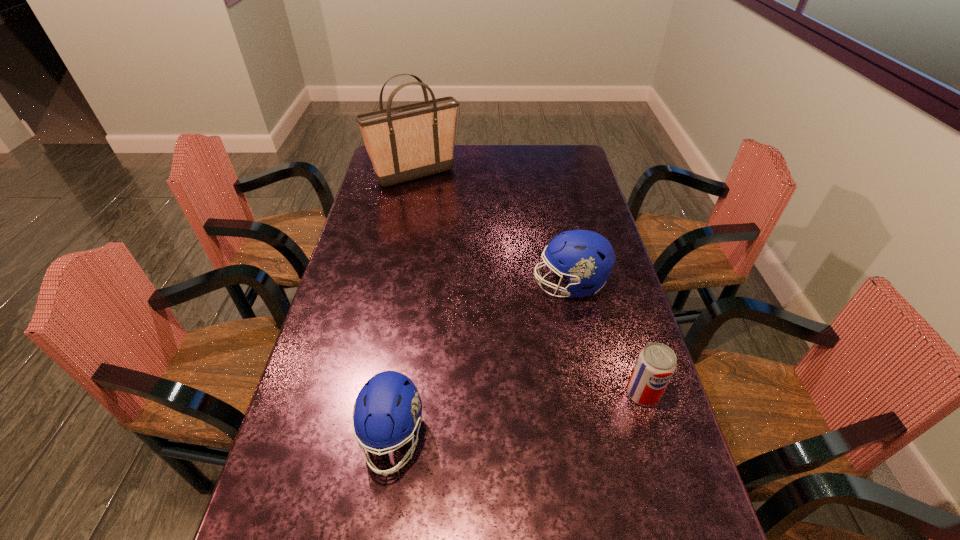
Identify the location of object that is the second closest to the farther football helmet. (388, 409).

At what (x,y) coordinates should I click in order to perform the action: click on the second closest object to the farthest object. Please return your answer as a coordinate pair (x, y). Looking at the image, I should click on (388, 409).

The image size is (960, 540). I want to click on vacant region that satisfies the following two spatial constraints: 1. on the face guard of the right football helmet; 2. on the front-facing side of the left football helmet, so (601, 438).

Where is `free space that satisfies the following two spatial constraints: 1. on the back side of the soda; 2. on the face guard of the right football helmet`? free space that satisfies the following two spatial constraints: 1. on the back side of the soda; 2. on the face guard of the right football helmet is located at coordinates (611, 285).

The image size is (960, 540). I want to click on free point that satisfies the following two spatial constraints: 1. on the face guard of the soda; 2. on the right side of the second farthest object, so click(592, 393).

At what (x,y) coordinates should I click in order to perform the action: click on free space that satisfies the following two spatial constraints: 1. on the face guard of the right football helmet; 2. on the right side of the soda. Please return your answer as a coordinate pair (x, y). Looking at the image, I should click on [592, 393].

This screenshot has height=540, width=960. I want to click on free location that satisfies the following two spatial constraints: 1. on the face guard of the second farthest object; 2. on the back side of the soda, so click(x=592, y=393).

This screenshot has width=960, height=540. Find the location of `free space that satisfies the following two spatial constraints: 1. on the face guard of the right football helmet; 2. on the right side of the soda`. free space that satisfies the following two spatial constraints: 1. on the face guard of the right football helmet; 2. on the right side of the soda is located at coordinates (592, 393).